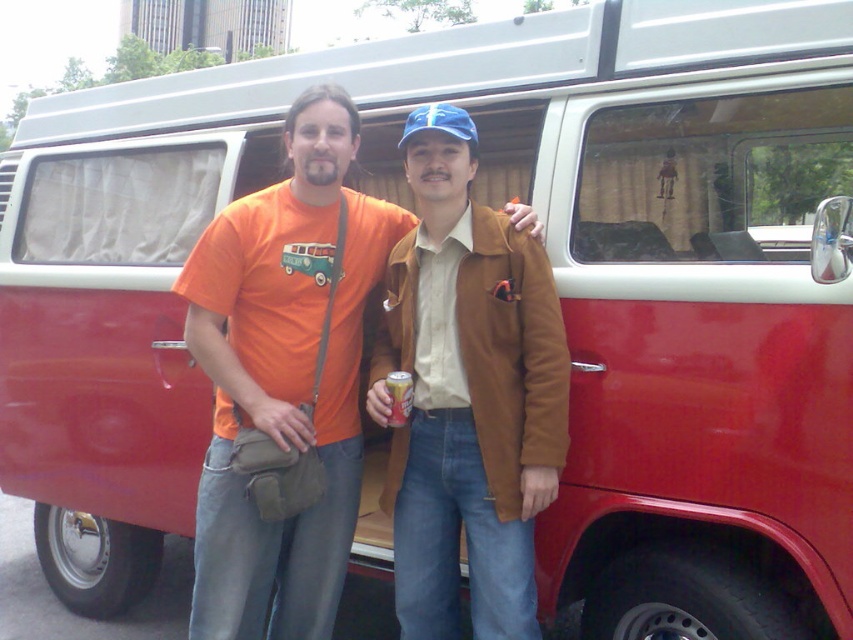
Who is positioned more to the left, orange cotton t-shirt at center or orange aluminum can at center?

Positioned to the left is orange cotton t-shirt at center.

Is orange cotton t-shirt at center further to camera compared to orange aluminum can at center?

No, orange cotton t-shirt at center is closer to the viewer.

Image resolution: width=853 pixels, height=640 pixels. Describe the element at coordinates (283, 376) in the screenshot. I see `orange cotton t-shirt at center` at that location.

This screenshot has height=640, width=853. I want to click on orange cotton t-shirt at center, so click(283, 376).

Is brown leather jacket at center bigger than orange aluminum can at center?

Correct, brown leather jacket at center is larger in size than orange aluminum can at center.

Does brown leather jacket at center have a lesser width compared to orange aluminum can at center?

No.

Which is in front, point (550, 492) or point (393, 390)?

Point (550, 492) is in front.

At what (x,y) coordinates should I click in order to perform the action: click on brown leather jacket at center. Please return your answer as a coordinate pair (x, y). Image resolution: width=853 pixels, height=640 pixels. Looking at the image, I should click on (467, 394).

Who is positioned more to the right, orange cotton t-shirt at center or brown leather jacket at center?

brown leather jacket at center is more to the right.

Which is behind, point (210, 321) or point (492, 339)?

Positioned behind is point (210, 321).

Find the location of `orange cotton t-shirt at center`. orange cotton t-shirt at center is located at coordinates (283, 376).